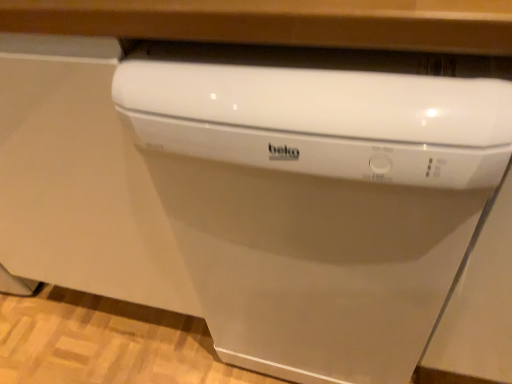
Measure the distance between point (x=326, y=353) and camera.

They are 34.29 inches apart.

The width and height of the screenshot is (512, 384). Describe the element at coordinates (319, 193) in the screenshot. I see `white glossy dishwasher at center` at that location.

You are a GUI agent. You are given a task and a screenshot of the screen. Output one action in this format:
    pyautogui.click(x=<x>, y=<y>)
    Task: Click on the white glossy dishwasher at center
    
    Given the screenshot: What is the action you would take?
    pyautogui.click(x=319, y=193)

You are a GUI agent. You are given a task and a screenshot of the screen. Output one action in this format:
    pyautogui.click(x=<x>, y=<y>)
    Task: Click on the white glossy dishwasher at center
    
    Given the screenshot: What is the action you would take?
    pyautogui.click(x=319, y=193)